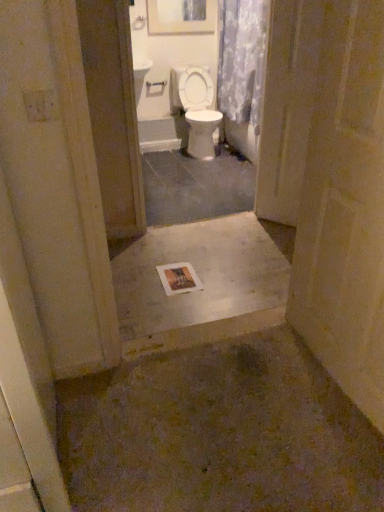
What is the approximate width of smooth beige door at lower right?

smooth beige door at lower right is 16.51 centimeters in width.

This screenshot has height=512, width=384. What do you see at coordinates (181, 16) in the screenshot?
I see `wooden framed artwork at upper center` at bounding box center [181, 16].

Describe the element at coordinates (242, 59) in the screenshot. I see `floral fabric shower curtain at upper center` at that location.

The height and width of the screenshot is (512, 384). Describe the element at coordinates (199, 111) in the screenshot. I see `white glossy toilet at center` at that location.

Where is `smooth beige door at lower right`? smooth beige door at lower right is located at coordinates (345, 208).

Consider the image. Which of these two, white glossy toilet at center or smooth concrete slab at center, is smaller?

Smaller between the two is smooth concrete slab at center.

How different are the orientations of white glossy toilet at center and smooth concrete slab at center in degrees?

They differ by 0.964 degrees in their facing directions.

I want to click on concrete below the white glossy toilet at center (from the image's perspective), so click(x=199, y=274).

From a real-world perspective, does white glossy toilet at center stand above smooth concrete slab at center?

Yes, from a real-world perspective, white glossy toilet at center is above smooth concrete slab at center.

Which of these two, wooden framed artwork at upper center or floral fabric shower curtain at upper center, stands taller?

Standing taller between the two is floral fabric shower curtain at upper center.

From the image's perspective, is wooden framed artwork at upper center on floral fabric shower curtain at upper center?

Yes.

Is wooden framed artwork at upper center aimed at floral fabric shower curtain at upper center?

No, wooden framed artwork at upper center is not oriented towards floral fabric shower curtain at upper center.

Find the location of a particular element. The width and height of the screenshot is (384, 512). picture frame above the floral fabric shower curtain at upper center (from the image's perspective) is located at coordinates (181, 16).

Is clear plastic screen door at center positioned before smooth beige door at lower right?

No, clear plastic screen door at center is further to the viewer.

Considering the sizes of objects clear plastic screen door at center and smooth beige door at lower right in the image provided, who is shorter, clear plastic screen door at center or smooth beige door at lower right?

smooth beige door at lower right is shorter.

Considering the relative positions of clear plastic screen door at center and smooth beige door at lower right in the image provided, is clear plastic screen door at center to the right of smooth beige door at lower right from the viewer's perspective?

In fact, clear plastic screen door at center is to the left of smooth beige door at lower right.

Is smooth beige door at lower right turned away from floral fabric shower curtain at upper center?

smooth beige door at lower right does not have its back to floral fabric shower curtain at upper center.

Is smooth beige door at lower right positioned far away from floral fabric shower curtain at upper center?

Yes, smooth beige door at lower right and floral fabric shower curtain at upper center are located far from each other.

From a real-world perspective, is smooth beige door at lower right positioned over floral fabric shower curtain at upper center based on gravity?

Actually, smooth beige door at lower right is physically below floral fabric shower curtain at upper center in the real world.

Locate an element on the screen. Image resolution: width=384 pixels, height=512 pixels. door on the right of floral fabric shower curtain at upper center is located at coordinates (345, 208).

Which of these two, clear plastic screen door at center or wooden framed artwork at upper center, stands taller?

Standing taller between the two is clear plastic screen door at center.

Is clear plastic screen door at center aimed at wooden framed artwork at upper center?

No, clear plastic screen door at center is not facing towards wooden framed artwork at upper center.

How different are the orientations of floral fabric shower curtain at upper center and smooth beige door at lower right in degrees?

3.76 degrees separate the facing orientations of floral fabric shower curtain at upper center and smooth beige door at lower right.

Looking at this image, from the image's perspective, is floral fabric shower curtain at upper center above or below smooth beige door at lower right?

Clearly, from the image's perspective, floral fabric shower curtain at upper center is above smooth beige door at lower right.

Is floral fabric shower curtain at upper center closer to camera compared to smooth beige door at lower right?

No, the depth of floral fabric shower curtain at upper center is greater than that of smooth beige door at lower right.

Considering the sizes of objects floral fabric shower curtain at upper center and smooth beige door at lower right in the image provided, who is taller, floral fabric shower curtain at upper center or smooth beige door at lower right?

smooth beige door at lower right.

Is white glossy toilet at center completely or partially outside of clear plastic screen door at center?

white glossy toilet at center lies outside clear plastic screen door at center's area.

Which object is positioned more to the left, white glossy toilet at center or clear plastic screen door at center?

white glossy toilet at center is more to the left.

Find the location of `toilet above the smooth concrete slab at center (from the image's perspective)`. toilet above the smooth concrete slab at center (from the image's perspective) is located at coordinates (199, 111).

Where is `picture frame on the left of the floral fabric shower curtain at upper center`? This screenshot has height=512, width=384. picture frame on the left of the floral fabric shower curtain at upper center is located at coordinates (181, 16).

From the image, which object appears to be farther from wooden framed artwork at upper center, smooth concrete slab at center or floral fabric shower curtain at upper center?

The object further to wooden framed artwork at upper center is smooth concrete slab at center.

When comparing their distances from floral fabric shower curtain at upper center, does smooth beige door at lower right or white glossy toilet at center seem closer?

Among the two, white glossy toilet at center is located nearer to floral fabric shower curtain at upper center.

Based on their spatial positions, is floral fabric shower curtain at upper center or smooth concrete slab at center closer to clear plastic screen door at center?

Among the two, smooth concrete slab at center is located nearer to clear plastic screen door at center.

Based on their spatial positions, is smooth beige door at lower right or wooden framed artwork at upper center closer to clear plastic screen door at center?

smooth beige door at lower right is positioned closer to the anchor clear plastic screen door at center.

Which object lies further to the anchor point wooden framed artwork at upper center, smooth beige door at lower right or floral fabric shower curtain at upper center?

Based on the image, smooth beige door at lower right appears to be further to wooden framed artwork at upper center.

When comparing their distances from smooth beige door at lower right, does clear plastic screen door at center or smooth concrete slab at center seem closer?

Among the two, smooth concrete slab at center is located nearer to smooth beige door at lower right.

Based on their spatial positions, is smooth beige door at lower right or clear plastic screen door at center further from wooden framed artwork at upper center?

Among the two, smooth beige door at lower right is located further to wooden framed artwork at upper center.

Based on their spatial positions, is clear plastic screen door at center or smooth concrete slab at center further from wooden framed artwork at upper center?

The object further to wooden framed artwork at upper center is smooth concrete slab at center.

Locate an element on the screen. toilet located between smooth beige door at lower right and wooden framed artwork at upper center in the depth direction is located at coordinates pos(199,111).

Identify the location of screen door located between smooth beige door at lower right and white glossy toilet at center in the depth direction. This screenshot has width=384, height=512. (287, 106).

Find the location of `toilet between floral fabric shower curtain at upper center and wooden framed artwork at upper center from front to back`. toilet between floral fabric shower curtain at upper center and wooden framed artwork at upper center from front to back is located at coordinates (199, 111).

Where is `concrete between smooth beige door at lower right and floral fabric shower curtain at upper center from front to back`? The image size is (384, 512). concrete between smooth beige door at lower right and floral fabric shower curtain at upper center from front to back is located at coordinates (199, 274).